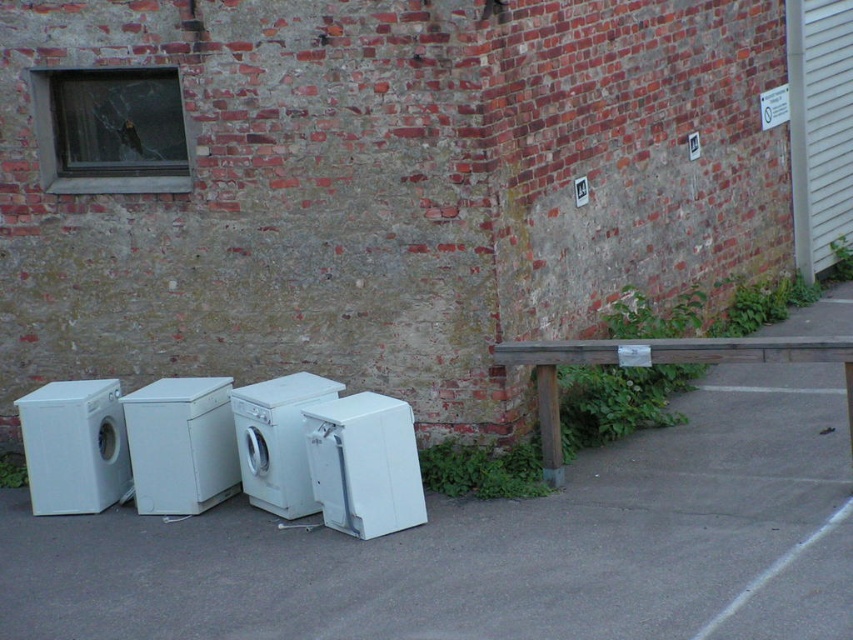
You are standing at the point with coordinates 0.855, 0.584. Looking at the scene, which object from the list below is exactly where you are standing? Choose from the following options based on their descriptions in the scene. The options are the white smooth pavement at lower center and the weathered brick wall.

The white smooth pavement at lower center is located at point (497,547), so you are standing on the white smooth pavement at lower center.

You are a delivery person trying to park your van in front of the white plastic washing machine at lower center. The van requires a clear space of 3 meters in front of the washing machine. Is there enough space provided by the white smooth pavement at lower center?

The white smooth pavement at lower center is in front of the white plastic washing machine at lower center, but the description does not specify the length of the pavement. Therefore, it is unclear if there is enough space for the van to park.